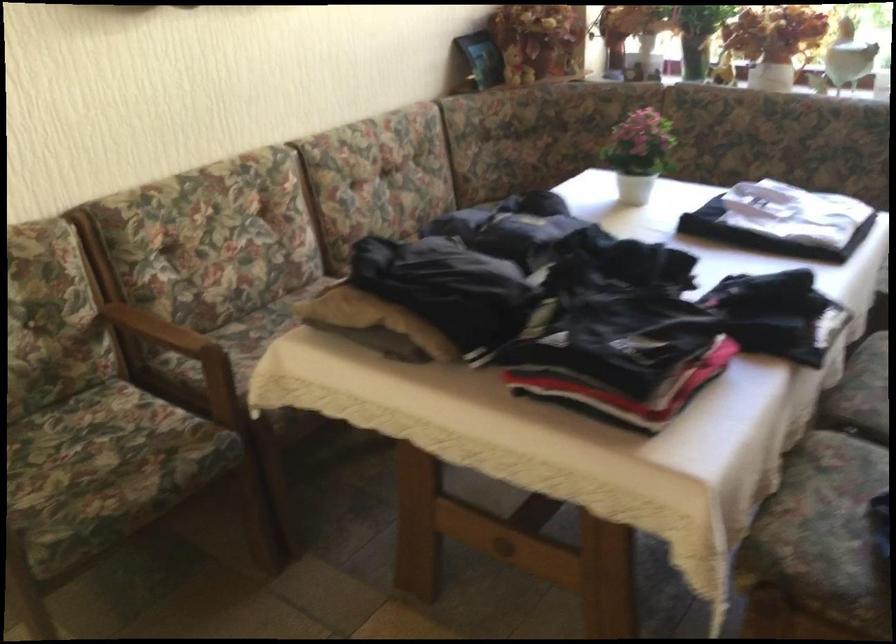
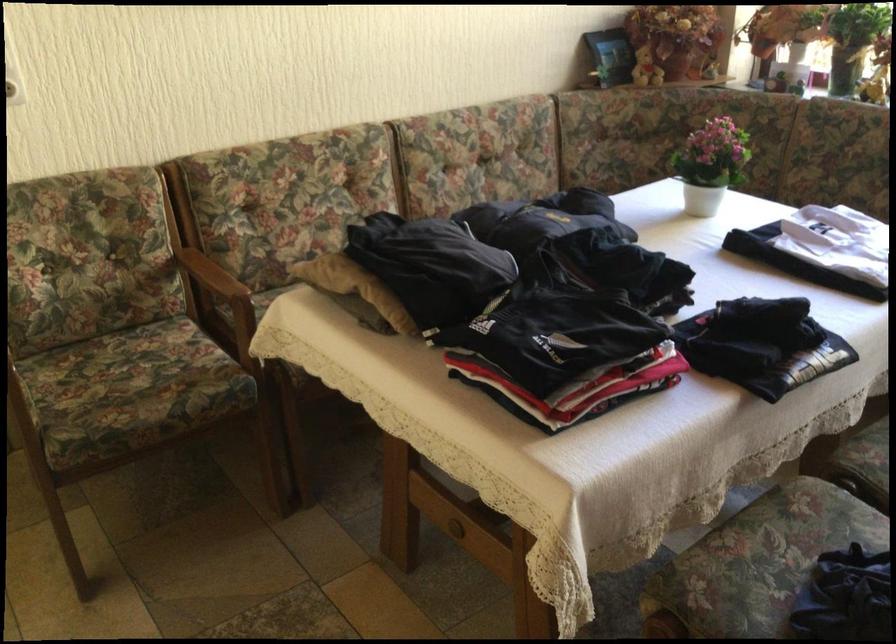
Where in the second image is the point corresponding to (x=148, y=323) from the first image?

(204, 269)